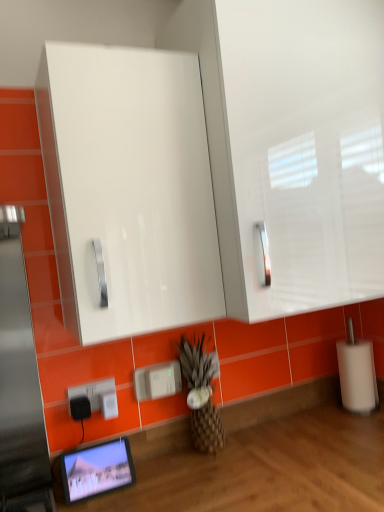
Question: Does white plastic electric outlet at lower left, positioned as the 2th electric outlet in left-to-right order, appear on the right side of white plastic charger at lower center, the 4th electric outlet in the left-to-right sequence?

Choices:
 (A) yes
 (B) no

Answer: (B)

Question: From a real-world perspective, is white plastic electric outlet at lower left, the 3th electric outlet positioned from the right, physically below white plastic charger at lower center, the 4th electric outlet in the left-to-right sequence?

Choices:
 (A) no
 (B) yes

Answer: (B)

Question: Does white plastic electric outlet at lower left, the 3th electric outlet positioned from the right, touch white plastic charger at lower center, the 4th electric outlet in the left-to-right sequence?

Choices:
 (A) yes
 (B) no

Answer: (B)

Question: Are white plastic electric outlet at lower left, positioned as the 2th electric outlet in left-to-right order, and white plastic charger at lower center, the 4th electric outlet in the left-to-right sequence, located far from each other?

Choices:
 (A) no
 (B) yes

Answer: (A)

Question: Can you confirm if white plastic electric outlet at lower left, positioned as the 2th electric outlet in left-to-right order, is shorter than white plastic charger at lower center, which is the first electric outlet from right to left?

Choices:
 (A) no
 (B) yes

Answer: (B)

Question: Is point (117, 443) positioned closer to the camera than point (162, 322)?

Choices:
 (A) farther
 (B) closer

Answer: (A)

Question: From a real-world perspective, relative to white glossy cabinet at upper center, is matte black tablet at lower left vertically above or below?

Choices:
 (A) above
 (B) below

Answer: (B)

Question: Is matte black tablet at lower left spatially inside white glossy cabinet at upper center, or outside of it?

Choices:
 (A) outside
 (B) inside

Answer: (A)

Question: In terms of height, does matte black tablet at lower left look taller or shorter compared to white glossy cabinet at upper center?

Choices:
 (A) short
 (B) tall

Answer: (A)

Question: Is burlap textured pineapple at center inside the boundaries of white plastic electric outlet at lower left, which is the second electric outlet in right-to-left order, or outside?

Choices:
 (A) inside
 (B) outside

Answer: (B)

Question: From the image's perspective, is burlap textured pineapple at center located above or below white plastic electric outlet at lower left, which is the second electric outlet in right-to-left order?

Choices:
 (A) above
 (B) below

Answer: (A)

Question: Considering the positions of burlap textured pineapple at center and white plastic electric outlet at lower left, which is the second electric outlet in right-to-left order, in the image, is burlap textured pineapple at center taller or shorter than white plastic electric outlet at lower left, which is the second electric outlet in right-to-left order,?

Choices:
 (A) tall
 (B) short

Answer: (A)

Question: From a real-world perspective, is burlap textured pineapple at center positioned above or below white plastic electric outlet at lower left, which is the third electric outlet in left-to-right order?

Choices:
 (A) above
 (B) below

Answer: (B)

Question: From the image's perspective, relative to white glossy cabinet at upper center, is white plastic electric outlet at lower left, which is the third electric outlet in left-to-right order, above or below?

Choices:
 (A) above
 (B) below

Answer: (B)

Question: From a real-world perspective, is white plastic electric outlet at lower left, which is the third electric outlet in left-to-right order, physically located above or below white glossy cabinet at upper center?

Choices:
 (A) below
 (B) above

Answer: (A)